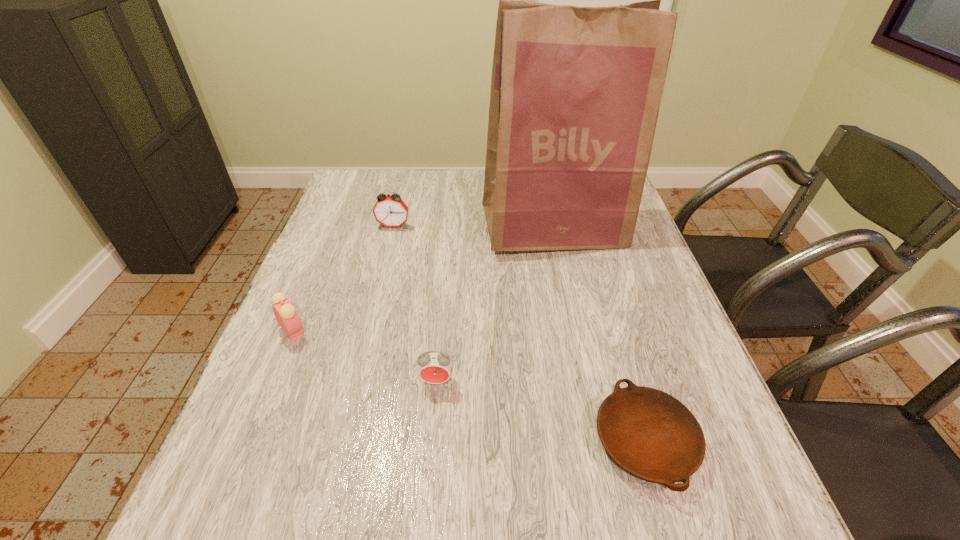
You are a GUI agent. You are given a task and a screenshot of the screen. Output one action in this format:
    pyautogui.click(x=<x>, y=<y>)
    Task: Click on the free space that satisfies the following two spatial constraints: 1. on the face of the shortest object; 2. on the left side of the rightmost alarm clock
    The height and width of the screenshot is (540, 960).
    Given the screenshot: What is the action you would take?
    pyautogui.click(x=431, y=441)

Image resolution: width=960 pixels, height=540 pixels. In order to click on free spot that satisfies the following two spatial constraints: 1. on the front-facing side of the grocery bag; 2. on the face of the leftmost object in this screenshot , I will do `click(576, 331)`.